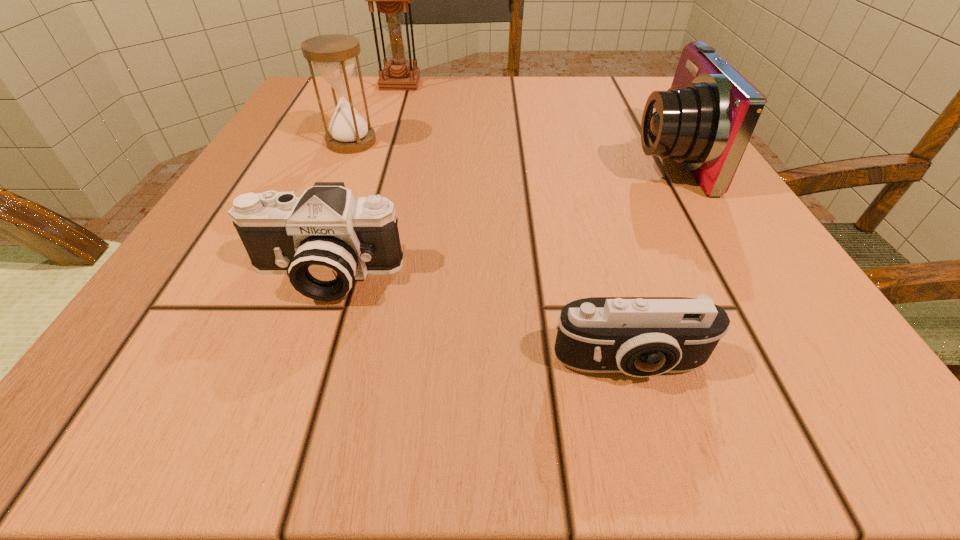
Locate an element on the screen. The height and width of the screenshot is (540, 960). vacant space positioned 0.180m on the front-facing side of the tallest camera is located at coordinates (521, 158).

Find the location of a particular element. The image size is (960, 540). free space located 0.140m on the front-facing side of the tallest camera is located at coordinates (545, 158).

Find the location of a particular element. free region located 0.240m on the front-facing side of the tallest camera is located at coordinates (485, 158).

Identify the location of vacant region located 0.370m on the right of the fourth tallest object. The image size is (960, 540). (707, 275).

Where is `hourglass that is at the far edge`? The image size is (960, 540). hourglass that is at the far edge is located at coordinates (391, 0).

Identify the location of camera that is at the far edge. The height and width of the screenshot is (540, 960). (705, 120).

Identify the location of object that is at the near edge. (641, 337).

Identify the location of camera that is at the left edge. This screenshot has width=960, height=540. (324, 240).

At what (x,y) coordinates should I click in order to perform the action: click on object that is at the far left corner. Please return your answer as a coordinate pair (x, y). The width and height of the screenshot is (960, 540). Looking at the image, I should click on (391, 0).

Where is `object positioned at the far right corner`? The image size is (960, 540). object positioned at the far right corner is located at coordinates (705, 120).